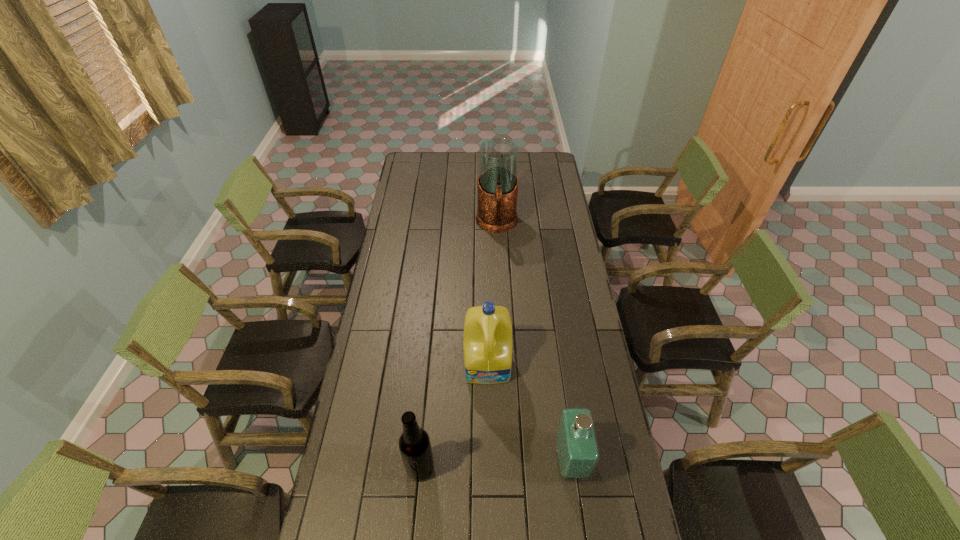
You are a GUI agent. You are given a task and a screenshot of the screen. Output one action in this format:
    pyautogui.click(x=<x>, y=<y>)
    Task: Click on the free spot located 0.260m with the handle on the side of the pitcher
    Image resolution: width=960 pixels, height=540 pixels.
    Given the screenshot: What is the action you would take?
    pyautogui.click(x=498, y=281)

In order to click on free spot located on the label of the detergent in this screenshot , I will do `click(493, 479)`.

Image resolution: width=960 pixels, height=540 pixels. What are the coordinates of `vacant area situated on the label of the detergent` in the screenshot? It's located at (492, 460).

You are a GUI agent. You are given a task and a screenshot of the screen. Output one action in this format:
    pyautogui.click(x=<x>, y=<y>)
    Task: Click on the free region located 0.350m on the label of the detergent
    This screenshot has height=540, width=960.
    Given the screenshot: What is the action you would take?
    pyautogui.click(x=493, y=485)

I want to click on object present at the right edge, so click(577, 453).

Where is `free space at the far edge`? free space at the far edge is located at coordinates click(444, 166).

Identify the location of vacant area at the left edge of the desktop. (393, 367).

Locate an element on the screen. vacant area at the right edge of the desktop is located at coordinates (546, 249).

I want to click on vacant space at the near left corner of the desktop, so click(351, 509).

Identify the location of vacant space at the near right corner of the desktop. The height and width of the screenshot is (540, 960). (619, 520).